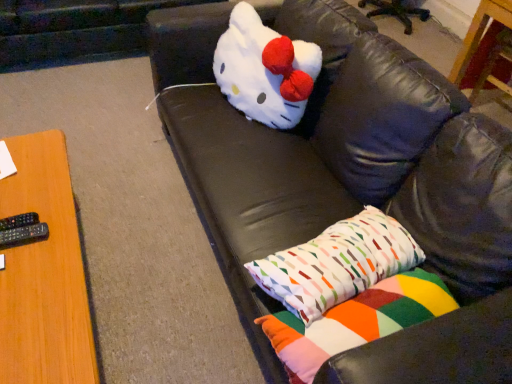
Find the location of a particular element. The image size is (512, 384). vacant space in front of black plastic remote at left, the 2th remote positioned from the top is located at coordinates (16, 283).